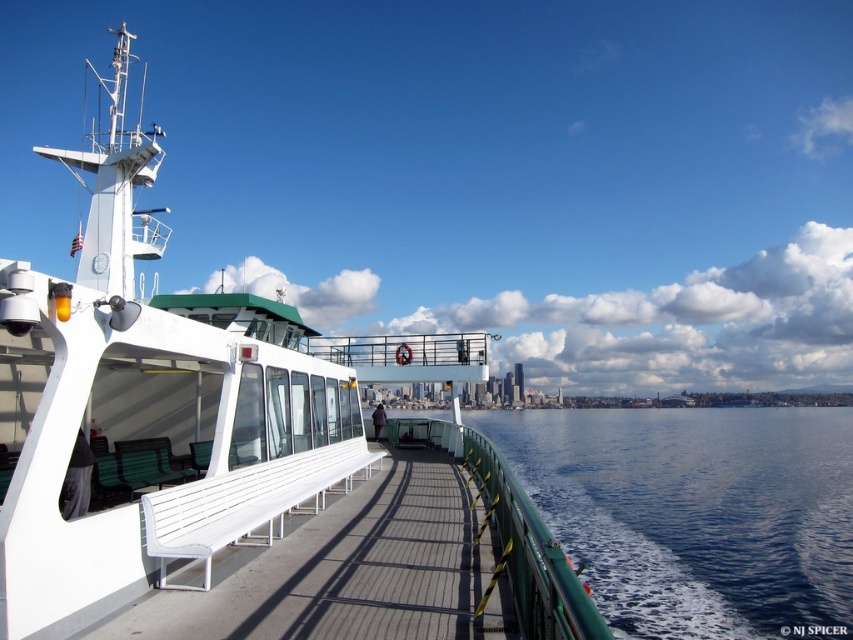
Which is below, white matte bench at center or blue water at center?

blue water at center is lower down.

Does white matte bench at center lie behind blue water at center?

No, white matte bench at center is in front of blue water at center.

This screenshot has width=853, height=640. Identify the location of white matte bench at center. (202, 419).

The image size is (853, 640). I want to click on white matte bench at center, so click(x=202, y=419).